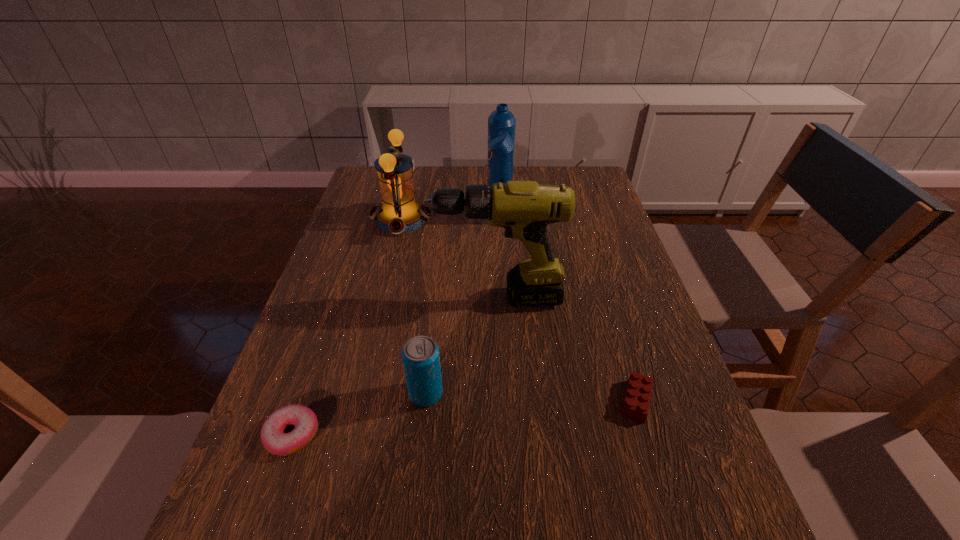
You are a GUI agent. You are given a task and a screenshot of the screen. Output one action in this format:
    pyautogui.click(x=<x>, y=<y>)
    Task: Click on the free space that is in between the soda can and the fourth shortest object
    This screenshot has width=960, height=540.
    Given the screenshot: What is the action you would take?
    pyautogui.click(x=414, y=306)

At what (x,y) coordinates should I click in order to perform the action: click on the fourth closest object to the fourth tallest object. Please return your answer as a coordinate pair (x, y). The height and width of the screenshot is (540, 960). Looking at the image, I should click on pyautogui.click(x=501, y=123).

Where is `object that is the closest one to the Lego`? The image size is (960, 540). object that is the closest one to the Lego is located at coordinates (524, 208).

Where is `vacant space that satisfies the following two spatial constraints: 1. on the front side of the shampoo; 2. on the right side of the Lego`? This screenshot has height=540, width=960. vacant space that satisfies the following two spatial constraints: 1. on the front side of the shampoo; 2. on the right side of the Lego is located at coordinates (510, 401).

Identify the location of free point that satisfies the following two spatial constraints: 1. on the front side of the third shortest object; 2. on the left side of the rightmost object. This screenshot has width=960, height=540. (425, 401).

What are the coordinates of `vacant position in the image that satisfies the following two spatial constraints: 1. on the handle side of the drill; 2. on the front side of the soda can` in the screenshot? It's located at (502, 393).

At what (x,y) coordinates should I click in order to perform the action: click on vacant position in the image that satisfies the following two spatial constraints: 1. on the front-facing side of the lantern; 2. on the right side of the fourth tallest object. Please return your answer as a coordinate pair (x, y). Image resolution: width=960 pixels, height=540 pixels. Looking at the image, I should click on (359, 393).

Find the location of `free space that satisfies the following two spatial constraints: 1. on the handle side of the Lego; 2. on the left side of the drill`. free space that satisfies the following two spatial constraints: 1. on the handle side of the Lego; 2. on the left side of the drill is located at coordinates (502, 401).

The height and width of the screenshot is (540, 960). I want to click on vacant space that satisfies the following two spatial constraints: 1. on the handle side of the rightmost object; 2. on the right side of the third farthest object, so click(x=502, y=401).

The image size is (960, 540). Find the location of `free location that satisfies the following two spatial constraints: 1. on the front-facing side of the lantern; 2. on the back side of the third shortest object`. free location that satisfies the following two spatial constraints: 1. on the front-facing side of the lantern; 2. on the back side of the third shortest object is located at coordinates pyautogui.click(x=359, y=393).